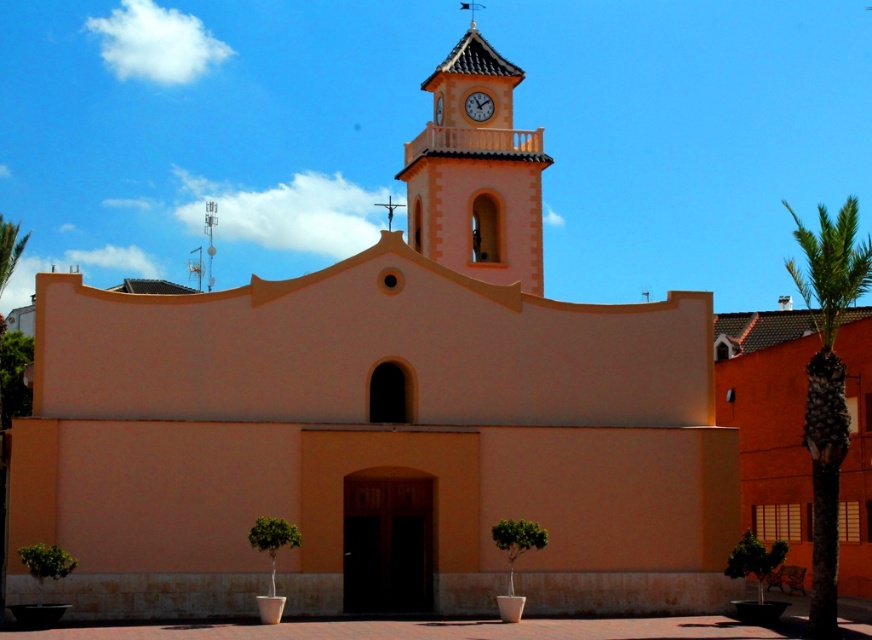
Question: Considering the real-world distances, which object is farthest from the white plastic clock at upper center?

Choices:
 (A) metallic spire at upper center
 (B) green leafy palm tree at left
 (C) matte orange clock tower at upper center

Answer: (A)

Question: Which point is farther from the camera taking this photo?

Choices:
 (A) (836, 621)
 (B) (445, 218)
 (C) (487, 104)
 (D) (208, 291)

Answer: (D)

Question: Does green leafy palm tree at right appear on the left side of white plastic clock at upper center?

Choices:
 (A) yes
 (B) no

Answer: (B)

Question: Can you confirm if matte orange clock tower at upper center is thinner than metallic spire at upper center?

Choices:
 (A) yes
 (B) no

Answer: (B)

Question: Which point is farther from the camera taking this photo?

Choices:
 (A) (845, 422)
 (B) (8, 273)
 (C) (479, 99)

Answer: (C)

Question: Can you confirm if metallic spire at upper center is wider than white plastic clock at upper center?

Choices:
 (A) no
 (B) yes

Answer: (B)